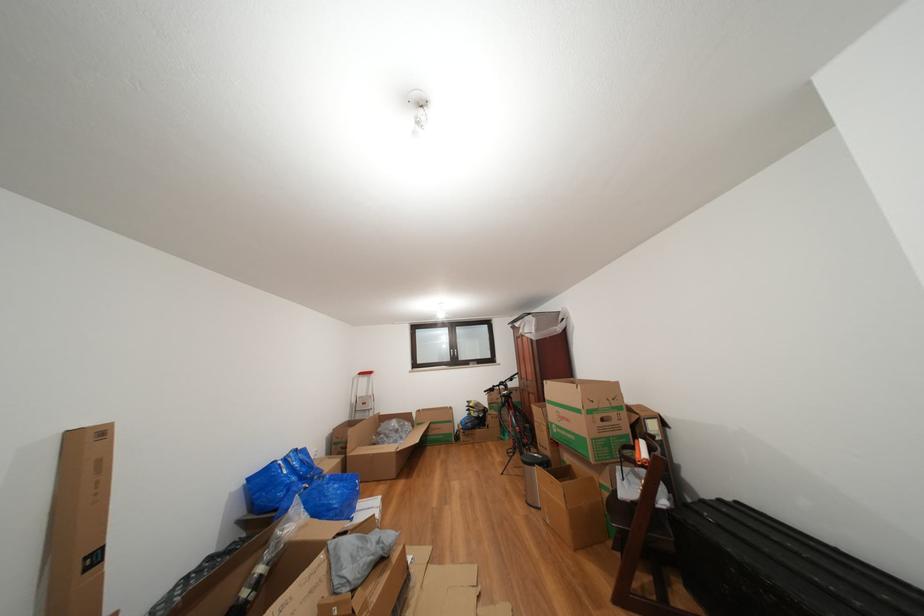
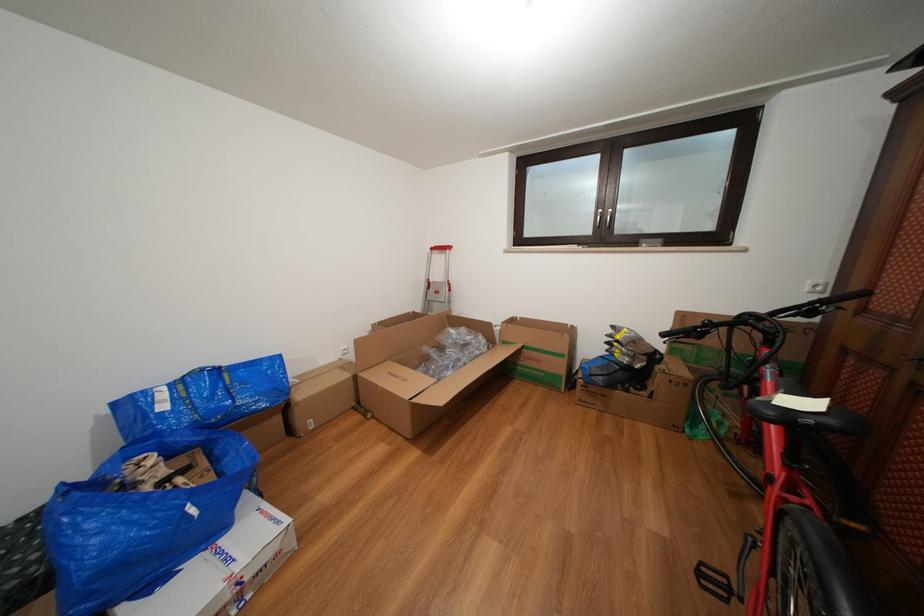
Where in the second image is the point corresponding to (x=369, y=379) from the first image?

(441, 254)